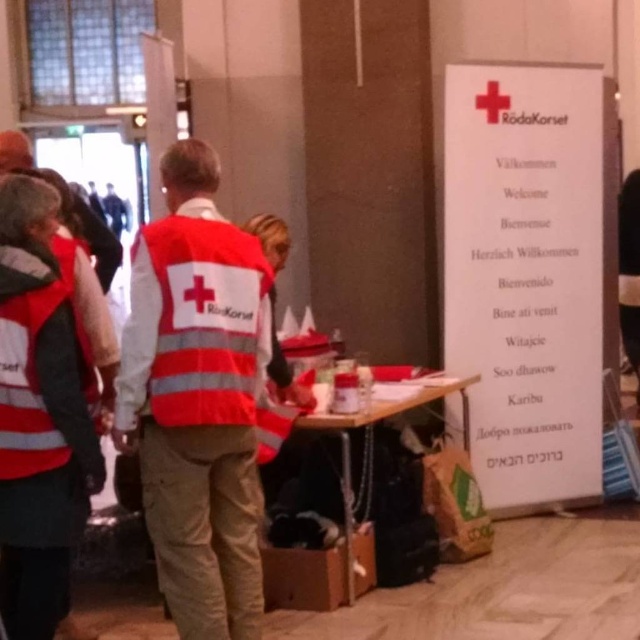
Can you confirm if reflective white safety vest at center is shorter than reflective silver vest at left?

No, reflective white safety vest at center is not shorter than reflective silver vest at left.

Can you confirm if reflective white safety vest at center is wider than reflective silver vest at left?

In fact, reflective white safety vest at center might be narrower than reflective silver vest at left.

Who is more forward, (221, 417) or (74, 212)?

Point (221, 417) is in front.

Where is `reflective white safety vest at center`? The image size is (640, 640). reflective white safety vest at center is located at coordinates (202, 320).

Does wooden table at center appear over reflective silver vest at left?

Actually, wooden table at center is below reflective silver vest at left.

Does wooden table at center come behind reflective silver vest at left?

Yes, it is.

What do you see at coordinates (372, 424) in the screenshot? I see `wooden table at center` at bounding box center [372, 424].

In order to click on wooden table at center in this screenshot , I will do `click(372, 424)`.

Who is positioned more to the right, reflective orange vest at center or reflective silver vest at left?

Positioned to the right is reflective orange vest at center.

Can you confirm if reflective orange vest at center is bigger than reflective silver vest at left?

Yes, reflective orange vest at center is bigger than reflective silver vest at left.

The width and height of the screenshot is (640, 640). What do you see at coordinates (196, 397) in the screenshot?
I see `reflective orange vest at center` at bounding box center [196, 397].

Locate an element on the screen. The width and height of the screenshot is (640, 640). reflective orange vest at center is located at coordinates (196, 397).